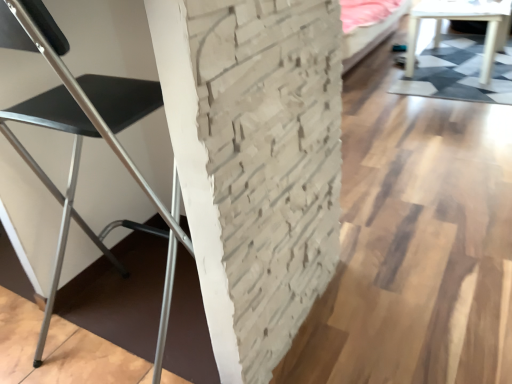
Question: From the image's perspective, relative to white glossy table at upper right, is black metal chair at left above or below?

Choices:
 (A) below
 (B) above

Answer: (A)

Question: Would you say black metal chair at left is to the left or to the right of white glossy table at upper right in the picture?

Choices:
 (A) right
 (B) left

Answer: (B)

Question: Considering the positions of black metal chair at left and white glossy table at upper right in the image, is black metal chair at left bigger or smaller than white glossy table at upper right?

Choices:
 (A) small
 (B) big

Answer: (A)

Question: From the image's perspective, is white glossy table at upper right above or below black metal chair at left?

Choices:
 (A) above
 (B) below

Answer: (A)

Question: Considering the positions of white glossy table at upper right and black metal chair at left in the image, is white glossy table at upper right bigger or smaller than black metal chair at left?

Choices:
 (A) small
 (B) big

Answer: (B)

Question: From their relative heights in the image, would you say white glossy table at upper right is taller or shorter than black metal chair at left?

Choices:
 (A) tall
 (B) short

Answer: (B)

Question: Is point (415, 18) positioned closer to the camera than point (76, 125)?

Choices:
 (A) farther
 (B) closer

Answer: (A)